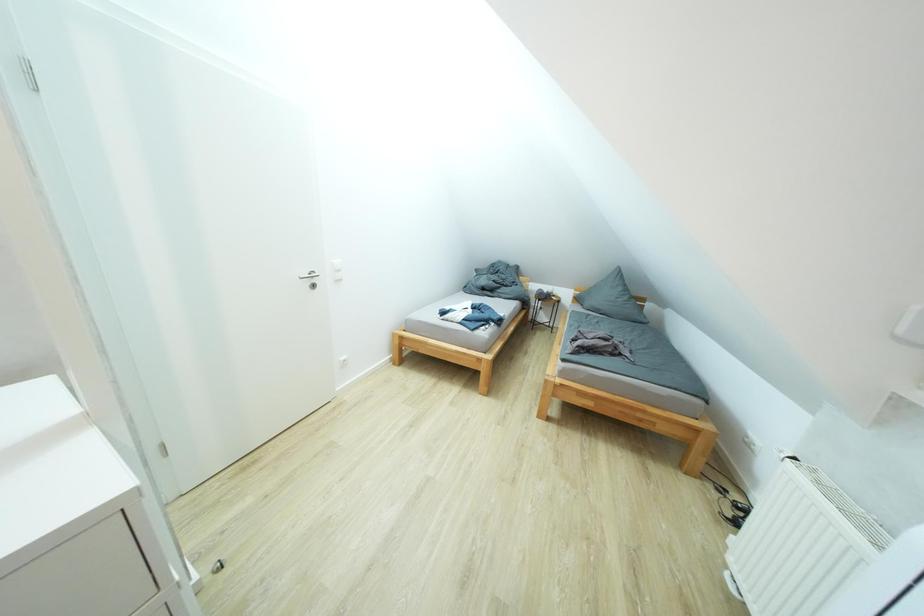
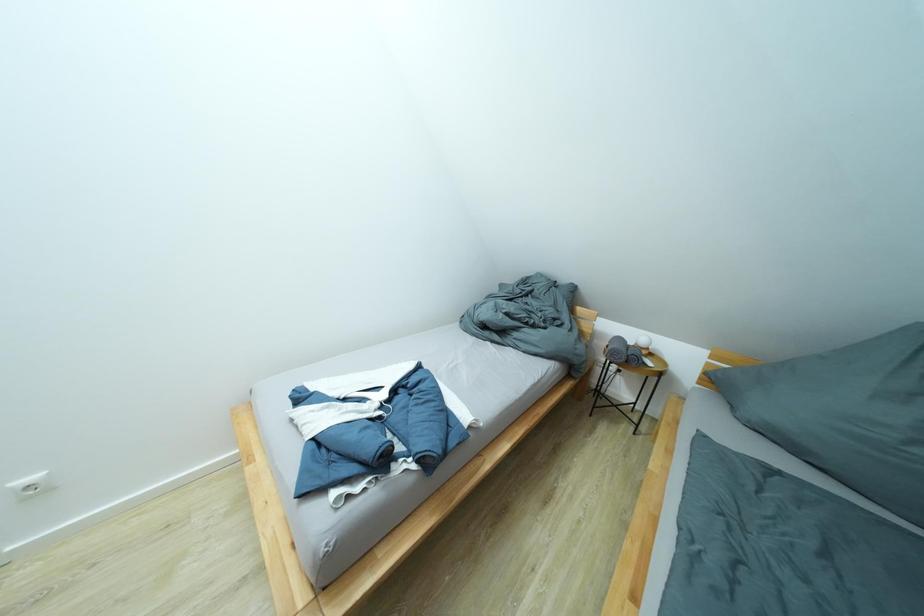
Which direction would the cameraman need to move to produce the second image?

The movement direction of the cameraman is right, forward.